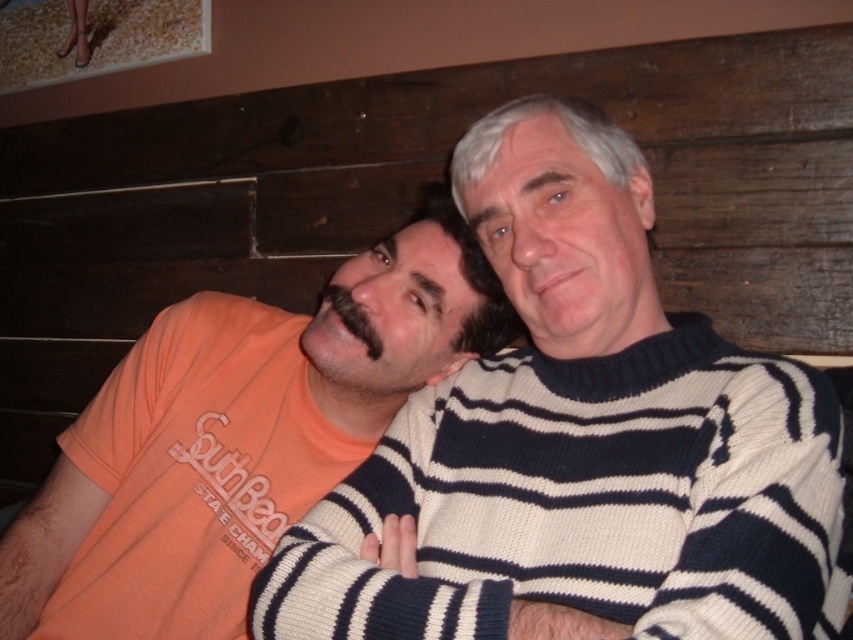
Can you confirm if knitted striped sweater at center is positioned below orange cotton t-shirt at left?

Actually, knitted striped sweater at center is above orange cotton t-shirt at left.

Identify the location of knitted striped sweater at center. The height and width of the screenshot is (640, 853). (581, 442).

Can you confirm if orange cotton t-shirt at left is wider than black fuzzy beard at center?

Indeed, orange cotton t-shirt at left has a greater width compared to black fuzzy beard at center.

Consider the image. Which of these two, orange cotton t-shirt at left or black fuzzy beard at center, stands taller?

orange cotton t-shirt at left

Which is behind, point (32, 513) or point (370, 342)?

The point (32, 513) is more distant.

Find the location of a particular element. orange cotton t-shirt at left is located at coordinates (235, 440).

Which is more to the left, knitted striped sweater at center or black fuzzy beard at center?

From the viewer's perspective, black fuzzy beard at center appears more on the left side.

Between point (424, 637) and point (363, 324), which one is positioned in front?

Point (424, 637)

Identify the location of knitted striped sweater at center. The image size is (853, 640). (581, 442).